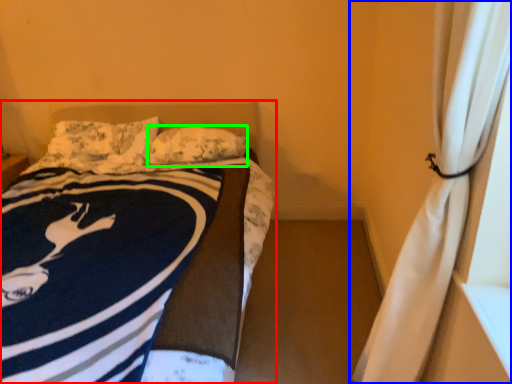
Question: Estimate the real-world distances between objects in this image. Which object is farther from bed (highlighted by a red box), curtain (highlighted by a blue box) or pillow (highlighted by a green box)?

Choices:
 (A) curtain
 (B) pillow

Answer: (A)